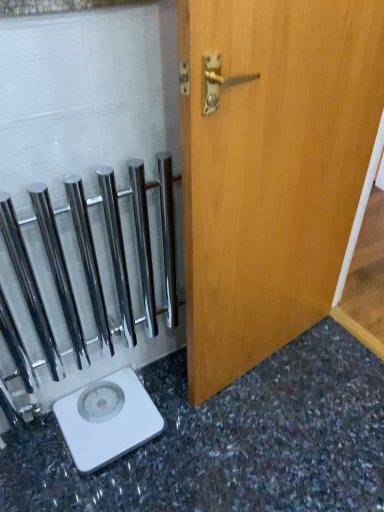
The image size is (384, 512). I want to click on vacant area that lies to the right of light brown wood door at center, so click(321, 368).